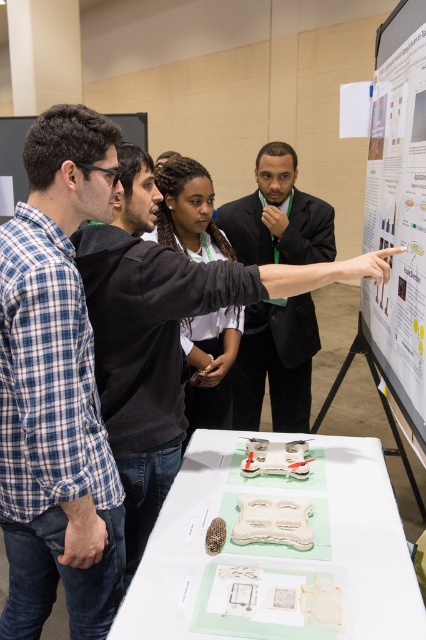
Question: Is blue plaid shirt at left below black matte shirt at center?

Choices:
 (A) yes
 (B) no

Answer: (B)

Question: Which of the following is the farthest from the observer?

Choices:
 (A) (402, 65)
 (B) (256, 314)
 (C) (55, 292)

Answer: (B)

Question: Among these objects, which one is farthest from the camera?

Choices:
 (A) black matte shirt at center
 (B) blue plaid shirt at left
 (C) black suit at center
 (D) white matte poster at upper right

Answer: (C)

Question: Which object appears closest to the camera in this image?

Choices:
 (A) black matte shirt at center
 (B) black suit at center
 (C) white matte poster at upper right
 (D) blue plaid shirt at left

Answer: (D)

Question: Does white matte poster at upper right come in front of black suit at center?

Choices:
 (A) yes
 (B) no

Answer: (A)

Question: Can you confirm if blue plaid shirt at left is positioned to the right of black matte shirt at center?

Choices:
 (A) yes
 (B) no

Answer: (B)